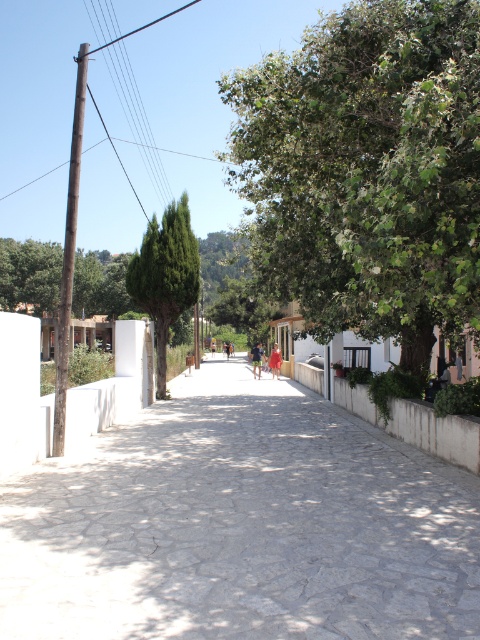
Question: Does gray stone path at center appear under green matte tree at center?

Choices:
 (A) no
 (B) yes

Answer: (B)

Question: Does gray stone path at center have a greater width compared to green leafy tree at center?

Choices:
 (A) yes
 (B) no

Answer: (B)

Question: Is green leafy tree at center thinner than green matte tree at center?

Choices:
 (A) no
 (B) yes

Answer: (A)

Question: Which point is farther to the camera?

Choices:
 (A) (181, 257)
 (B) (91, 467)
 (C) (336, 310)

Answer: (A)

Question: Which of the following is the closest to the observer?

Choices:
 (A) (298, 150)
 (B) (173, 317)

Answer: (A)

Question: Which of the following is the closest to the observer?

Choices:
 (A) green leafy tree at center
 (B) green matte tree at center
 (C) gray stone path at center

Answer: (C)